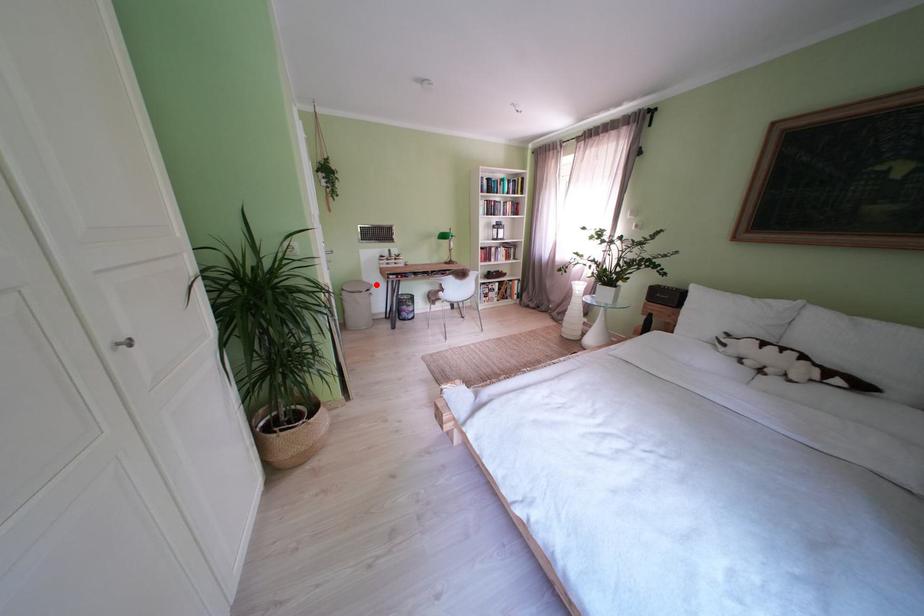
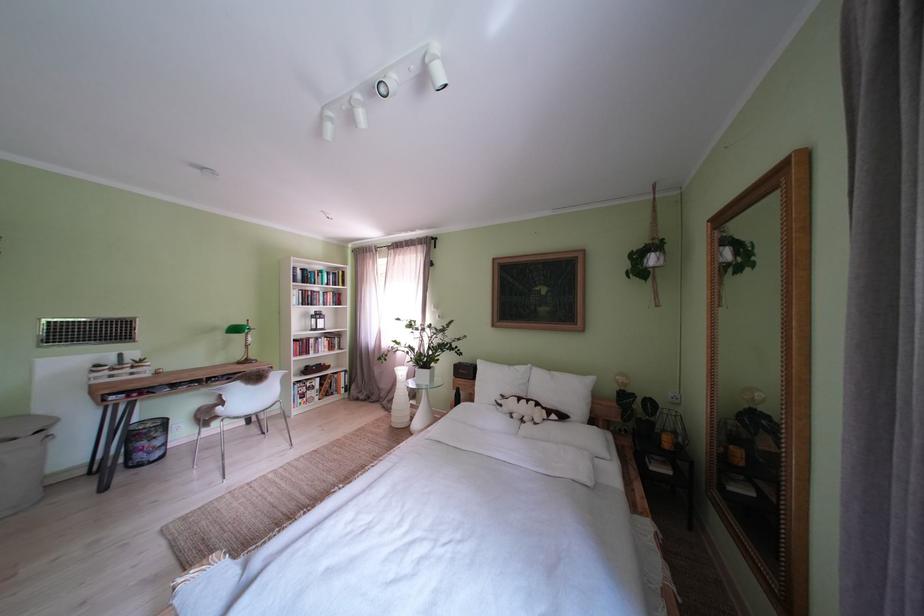
Question: I am providing you with two images of the same scene from different viewpoints. A red point is shown in image1. For the corresponding object point in image2, is it positioned nearer or farther from the camera?

Choices:
 (A) Nearer
 (B) Farther

Answer: (B)